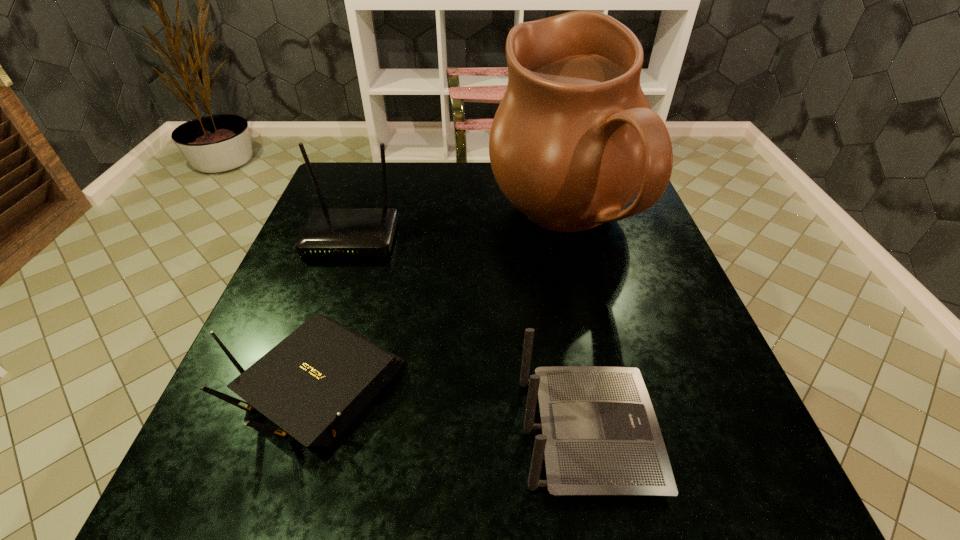
Find the location of `free location located 0.100m on the front-facing side of the third tallest object`. free location located 0.100m on the front-facing side of the third tallest object is located at coordinates (716, 433).

Image resolution: width=960 pixels, height=540 pixels. I want to click on free space located on the right of the shortest router, so click(x=538, y=383).

This screenshot has width=960, height=540. I want to click on object situated at the far edge, so click(574, 140).

Where is `cream pitcher that is at the right edge`? Image resolution: width=960 pixels, height=540 pixels. cream pitcher that is at the right edge is located at coordinates (574, 140).

Identify the location of router that is at the right edge. Image resolution: width=960 pixels, height=540 pixels. (600, 436).

The width and height of the screenshot is (960, 540). I want to click on object present at the near left corner, so click(314, 383).

Identify the location of object located at the far right corner. (574, 140).

Locate an element on the screen. Image resolution: width=960 pixels, height=540 pixels. object present at the near right corner is located at coordinates (600, 436).

At what (x,y) coordinates should I click in order to perform the action: click on vacant space at the far edge. Please return your answer as a coordinate pair (x, y). Looking at the image, I should click on point(512,206).

In order to click on free space at the left edge of the desktop in this screenshot , I will do `click(281, 319)`.